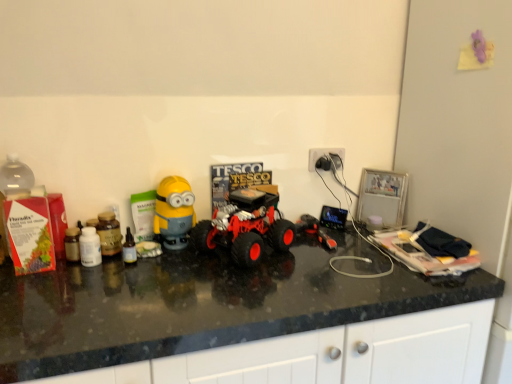
Locate an element on the screen. The height and width of the screenshot is (384, 512). spots to the right of rubberized red monster truck at center, which is counted as the second toy, starting from the left is located at coordinates (332, 260).